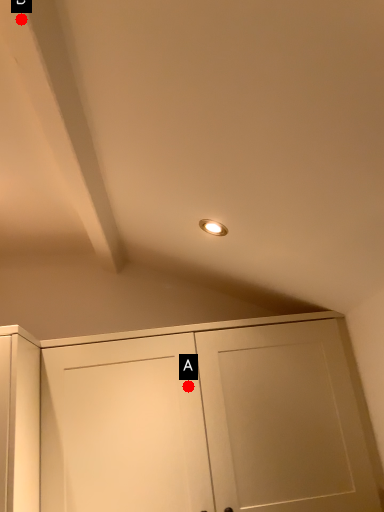
Question: Two points are circled on the image, labeled by A and B beside each circle. Which point appears farthest from the camera in this image?

Choices:
 (A) A is further
 (B) B is further

Answer: (A)